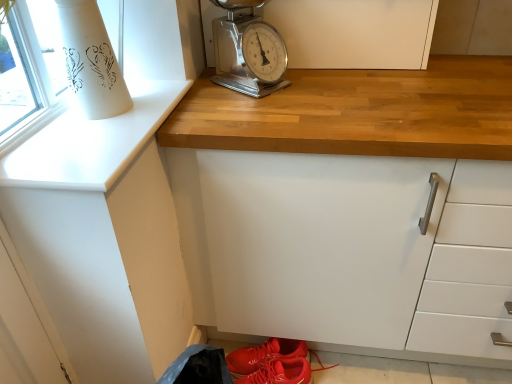
Question: Is white matte cabinet at upper center, placed as the first cabinetry when sorted from back to front, in front of or behind metallic scale at upper center in the image?

Choices:
 (A) behind
 (B) front

Answer: (A)

Question: From their relative heights in the image, would you say white matte cabinet at upper center, the second cabinetry from the front, is taller or shorter than metallic scale at upper center?

Choices:
 (A) tall
 (B) short

Answer: (B)

Question: Which object is the closest to the white matte cabinet at upper center, the second cabinetry from the front?

Choices:
 (A) metallic scale at upper center
 (B) shiny leather sneakers at lower center
 (C) white matte cabinet at upper center, placed as the 2th cabinetry when sorted from back to front

Answer: (A)

Question: Which of these objects is positioned farthest from the shiny leather sneakers at lower center?

Choices:
 (A) metallic scale at upper center
 (B) white matte cabinet at upper center, the second cabinetry from the front
 (C) white matte cabinet at upper center, placed as the 2th cabinetry when sorted from back to front

Answer: (B)